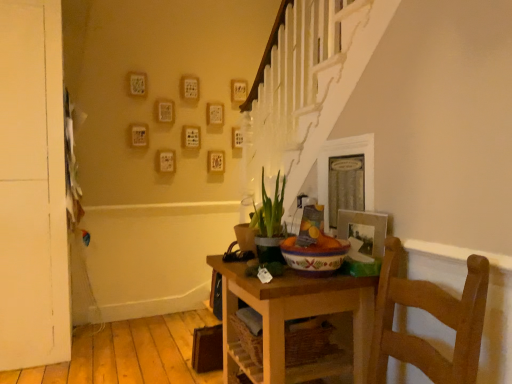
The height and width of the screenshot is (384, 512). Find the location of `free region on the left part of green matte plant at center`. free region on the left part of green matte plant at center is located at coordinates (233, 266).